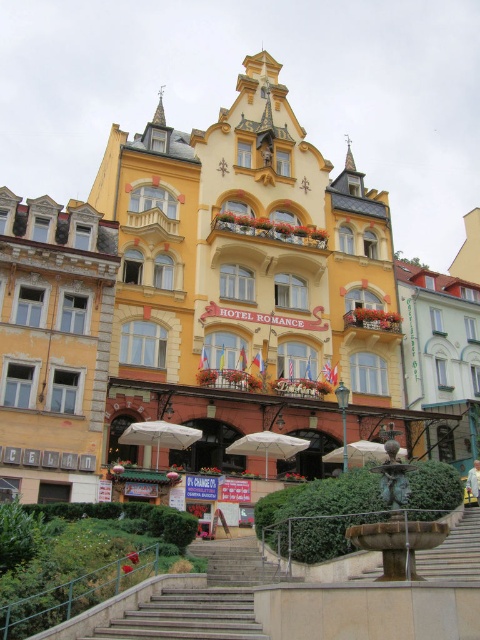
Can you confirm if gray concrete stairs at lower center is bigger than white matte umbrella at lower center?

Correct, gray concrete stairs at lower center is larger in size than white matte umbrella at lower center.

Does point (158, 628) come behind point (180, 436)?

No, (158, 628) is in front of (180, 436).

Does point (163, 596) lie behind point (179, 438)?

No, it is not.

Where is `gray concrete stairs at lower center`? The height and width of the screenshot is (640, 480). gray concrete stairs at lower center is located at coordinates (200, 602).

Between point (73, 316) and point (349, 448), which one is positioned behind?

Point (349, 448)

Who is lower down, yellow weathered building at left or white fabric umbrella at center?

Positioned lower is white fabric umbrella at center.

Who is more forward, (83, 298) or (359, 444)?

Point (83, 298) is in front.

At what (x,y) coordinates should I click in order to perform the action: click on yellow weathered building at left. Please return your answer as a coordinate pair (x, y). The width and height of the screenshot is (480, 640). Looking at the image, I should click on (x=54, y=346).

Is brown stone stairs at lower center smaller than white matte umbrella at lower center?

No.

Where is `brown stone stairs at lower center`? The width and height of the screenshot is (480, 640). brown stone stairs at lower center is located at coordinates (455, 548).

The width and height of the screenshot is (480, 640). What are the coordinates of `brown stone stairs at lower center` in the screenshot? It's located at (455, 548).